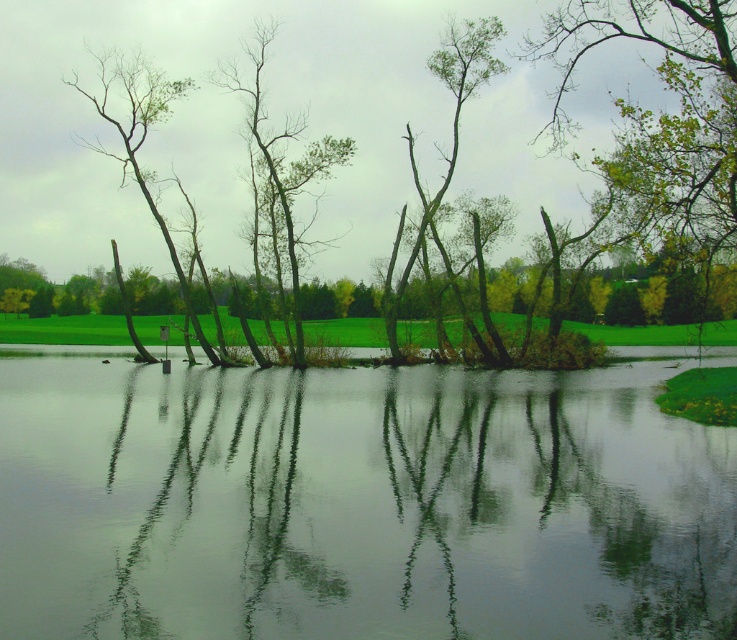
Question: Observing the image, what is the correct spatial positioning of green leafy tree at upper right in reference to bare wood tree at left?

Choices:
 (A) left
 (B) right

Answer: (B)

Question: Among these objects, which one is farthest from the camera?

Choices:
 (A) green leafy tree at upper right
 (B) bare wood tree at left
 (C) transparent water at center
 (D) green leafy tree at center

Answer: (D)

Question: Does transparent water at center have a smaller size compared to green leafy tree at upper right?

Choices:
 (A) no
 (B) yes

Answer: (B)

Question: Is transparent water at center thinner than green leafy tree at upper right?

Choices:
 (A) yes
 (B) no

Answer: (B)

Question: Considering the real-world distances, which object is farthest from the bare branches at center?

Choices:
 (A) green leafy tree at center
 (B) bare wood tree at left
 (C) transparent water at center
 (D) green leafy tree at upper right

Answer: (C)

Question: Which object is closer to the camera taking this photo?

Choices:
 (A) green leafy tree at upper right
 (B) bare wood tree at left

Answer: (A)